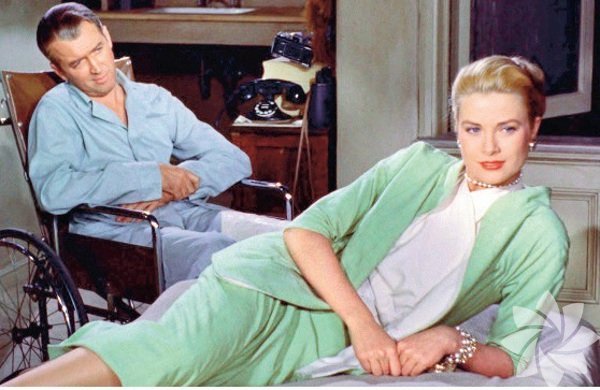
Image resolution: width=600 pixels, height=390 pixels. I want to click on phone, so (261, 111).